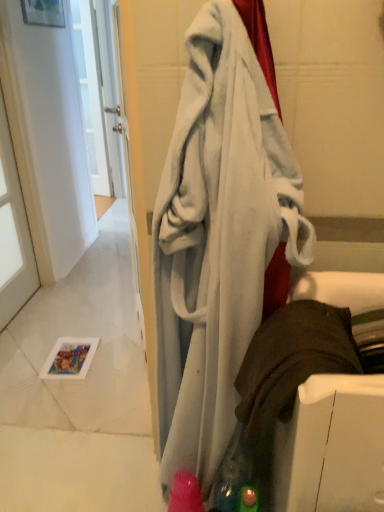
Locate an element on the screen. soft white towel at center is located at coordinates (221, 233).

This screenshot has height=512, width=384. Describe the element at coordinates (221, 233) in the screenshot. I see `soft white towel at center` at that location.

Measure the distance between soft white towel at center and camera.

soft white towel at center is 30.45 inches from camera.

Identify the location of transparent glass door at left. (13, 233).

Describe the element at coordinates (13, 233) in the screenshot. I see `transparent glass door at left` at that location.

Measure the distance between transparent glass door at left and camera.

The depth of transparent glass door at left is 2.09 meters.

You are a GUI agent. You are given a task and a screenshot of the screen. Output one action in this format:
    pyautogui.click(x=<x>, y=<y>)
    Task: Click on the soft white towel at center
    This screenshot has height=512, width=384.
    Given the screenshot: What is the action you would take?
    pyautogui.click(x=221, y=233)

Does soft white towel at center appear on the right side of transparent glass door at left?

Correct, you'll find soft white towel at center to the right of transparent glass door at left.

Is soft white towel at center closer to camera compared to transparent glass door at left?

Yes, soft white towel at center is in front of transparent glass door at left.

Considering the points (174, 456) and (17, 172), which point is behind, point (174, 456) or point (17, 172)?

The point (17, 172) is behind.

From the image's perspective, which one is positioned lower, soft white towel at center or transparent glass door at left?

From the image's view, soft white towel at center is below.

From a real-world perspective, is soft white towel at center physically located above or below transparent glass door at left?

Clearly, from a real-world perspective, soft white towel at center is above transparent glass door at left.

Does soft white towel at center have a greater width compared to transparent glass door at left?

Yes, soft white towel at center is wider than transparent glass door at left.

Between soft white towel at center and transparent glass door at left, which one has more height?

With more height is transparent glass door at left.

Between soft white towel at center and transparent glass door at left, which one has larger size?

Bigger between the two is soft white towel at center.

Is transparent glass door at left surrounded by soft white towel at center?

Actually, transparent glass door at left is outside soft white towel at center.

Is soft white towel at center positioned far away from transparent glass door at left?

soft white towel at center is positioned a significant distance from transparent glass door at left.

Is soft white towel at center facing away from transparent glass door at left?

A: soft white towel at center is not turned away from transparent glass door at left.

From the picture: How many degrees apart are the facing directions of soft white towel at center and transparent glass door at left?

179 degrees separate the facing orientations of soft white towel at center and transparent glass door at left.

How far apart are soft white towel at center and transparent glass door at left?

5.06 feet.

This screenshot has width=384, height=512. I want to click on towel on the right of transparent glass door at left, so click(221, 233).

Between transparent glass door at left and soft white towel at center, which one appears on the left side from the viewer's perspective?

transparent glass door at left.

In the scene shown: Is transparent glass door at left in front of or behind soft white towel at center in the image?

Visually, transparent glass door at left is located behind soft white towel at center.

Is point (21, 289) positioned in front of point (241, 170)?

No, (21, 289) is further to viewer.

From the image's perspective, which object appears higher, transparent glass door at left or soft white towel at center?

transparent glass door at left, from the image's perspective.

From a real-world perspective, is transparent glass door at left above or below soft white towel at center?

In terms of real-world spatial position, transparent glass door at left is below soft white towel at center.

Is transparent glass door at left thinner than soft white towel at center?

Correct, the width of transparent glass door at left is less than that of soft white towel at center.

In terms of height, does transparent glass door at left look taller or shorter compared to soft white towel at center?

In the image, transparent glass door at left appears to be taller than soft white towel at center.

Can you confirm if transparent glass door at left is bigger than soft white towel at center?

No.

Would you say transparent glass door at left contains soft white towel at center?

No, soft white towel at center is not inside transparent glass door at left.

Is transparent glass door at left in contact with soft white towel at center?

No, transparent glass door at left is not next to soft white towel at center.

Is transparent glass door at left facing towards soft white towel at center?

No, transparent glass door at left is not oriented towards soft white towel at center.

How many degrees apart are the facing directions of transparent glass door at left and soft white towel at center?

There is a 179-degree angle between the facing directions of transparent glass door at left and soft white towel at center.

How far apart are transparent glass door at left and soft white towel at center?

5.06 feet.

Where is `window lying on the left of soft white towel at center`? This screenshot has width=384, height=512. window lying on the left of soft white towel at center is located at coordinates (13, 233).

Locate an element on the screen. This screenshot has height=512, width=384. towel above the transparent glass door at left (from a real-world perspective) is located at coordinates (221, 233).

At what (x,y) coordinates should I click in order to perform the action: click on window below the soft white towel at center (from a real-world perspective). Please return your answer as a coordinate pair (x, y). Looking at the image, I should click on (13, 233).